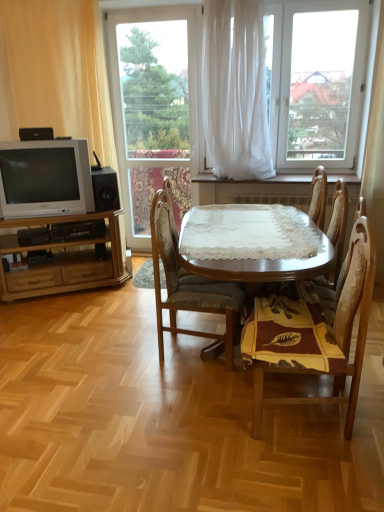
The image size is (384, 512). Find the location of `vacant region to the left of wooden table at center`. vacant region to the left of wooden table at center is located at coordinates (x=87, y=345).